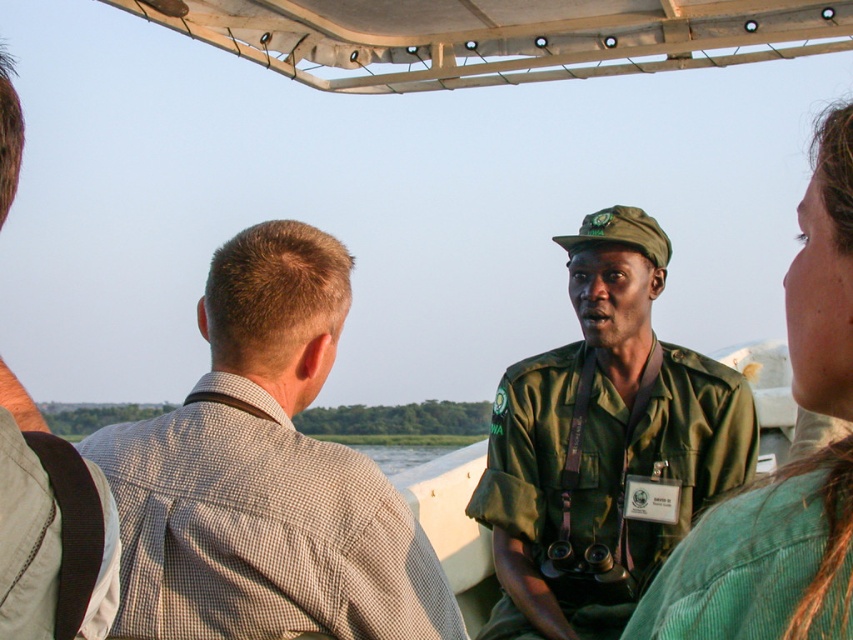
Question: Which point is closer to the camera?

Choices:
 (A) [x=755, y=589]
 (B) [x=224, y=380]
 (C) [x=723, y=428]
 (D) [x=51, y=572]

Answer: (D)

Question: Which is farther from the green matte uniform at center?

Choices:
 (A) light brown fabric shirt at left
 (B) green corduroy shirt at center
 (C) brown checkered shirt at left

Answer: (A)

Question: Which point is farther to the camera?

Choices:
 (A) brown checkered shirt at left
 (B) green corduroy shirt at center
 (C) light brown fabric shirt at left

Answer: (A)

Question: Does brown checkered shirt at left appear under light brown fabric shirt at left?

Choices:
 (A) yes
 (B) no

Answer: (B)

Question: Is brown checkered shirt at left to the left of light brown fabric shirt at left from the viewer's perspective?

Choices:
 (A) yes
 (B) no

Answer: (B)

Question: Does green matte uniform at center come in front of green corduroy shirt at center?

Choices:
 (A) no
 (B) yes

Answer: (A)